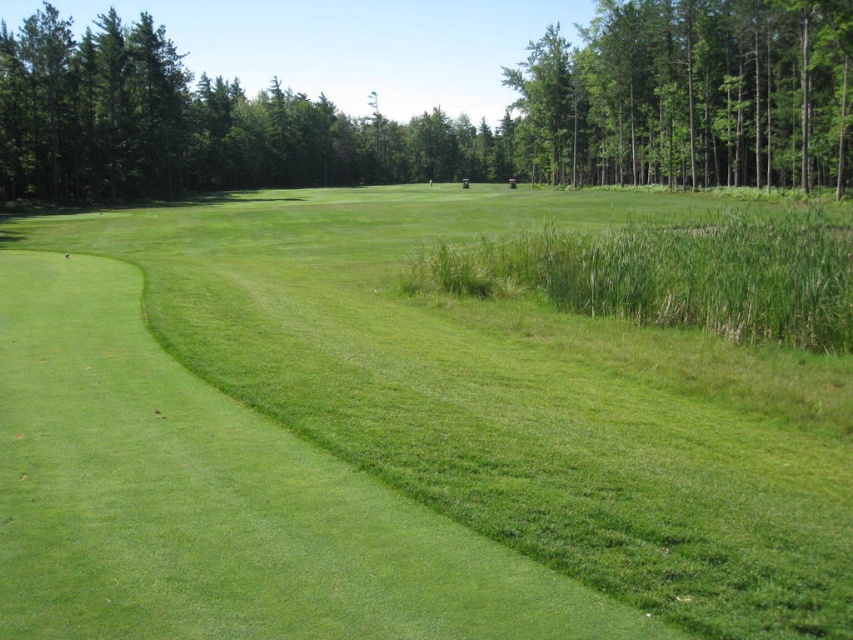
Is green leafy tree at upper center smaller than green leafy trees at upper right?

No, green leafy tree at upper center is not smaller than green leafy trees at upper right.

Does green leafy tree at upper center have a lesser height compared to green leafy trees at upper right?

Incorrect, green leafy tree at upper center's height does not fall short of green leafy trees at upper right's.

At what (x,y) coordinates should I click in order to perform the action: click on green leafy tree at upper center. Please return your answer as a coordinate pair (x, y). The width and height of the screenshot is (853, 640). Looking at the image, I should click on (440, 109).

Find the location of a particular element. The width and height of the screenshot is (853, 640). green leafy tree at upper center is located at coordinates (440, 109).

Is green grassy field at center below green leafy tree at upper center?

Correct, green grassy field at center is located below green leafy tree at upper center.

Does point (444, 193) lie behind point (775, 44)?

Yes, point (444, 193) is behind point (775, 44).

What do you see at coordinates (483, 428) in the screenshot? I see `green grassy field at center` at bounding box center [483, 428].

You are a GUI agent. You are given a task and a screenshot of the screen. Output one action in this format:
    pyautogui.click(x=<x>, y=<y>)
    Task: Click on the green grassy field at center
    The image size is (853, 640).
    Given the screenshot: What is the action you would take?
    pyautogui.click(x=483, y=428)

Where is `green grassy field at center`? Image resolution: width=853 pixels, height=640 pixels. green grassy field at center is located at coordinates (483, 428).

Does green grassy field at center lie in front of green leafy trees at upper right?

Yes, it is.

Is point (390, 340) farther from camera compared to point (659, 6)?

No.

Where is `green grassy field at center`? green grassy field at center is located at coordinates click(483, 428).